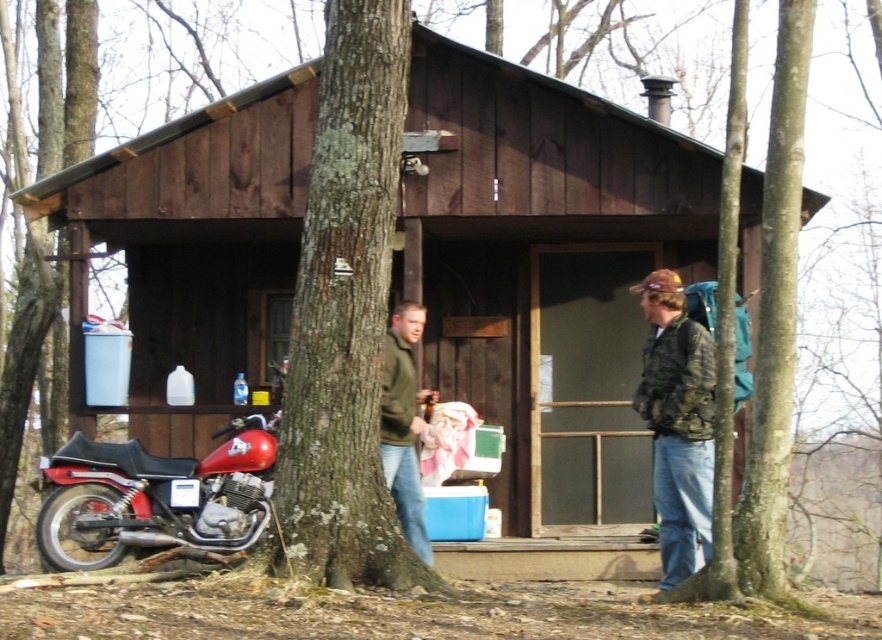
You are standing in front of the cabin and see a camouflage jacket at right. If you want to place it on the red motorcycle, which part of the motorcycle should you place it on?

The camouflage jacket at right should be placed on the black seat of the red motorcycle since it is the most logical and accessible location for placing items on a motorcycle.

You are standing in front of the cabin and see both the camouflage jacket at right and the green fuzzy sweater at center. Which one is nearer to you?

The camouflage jacket at right is closer to the viewer than the green fuzzy sweater at center.